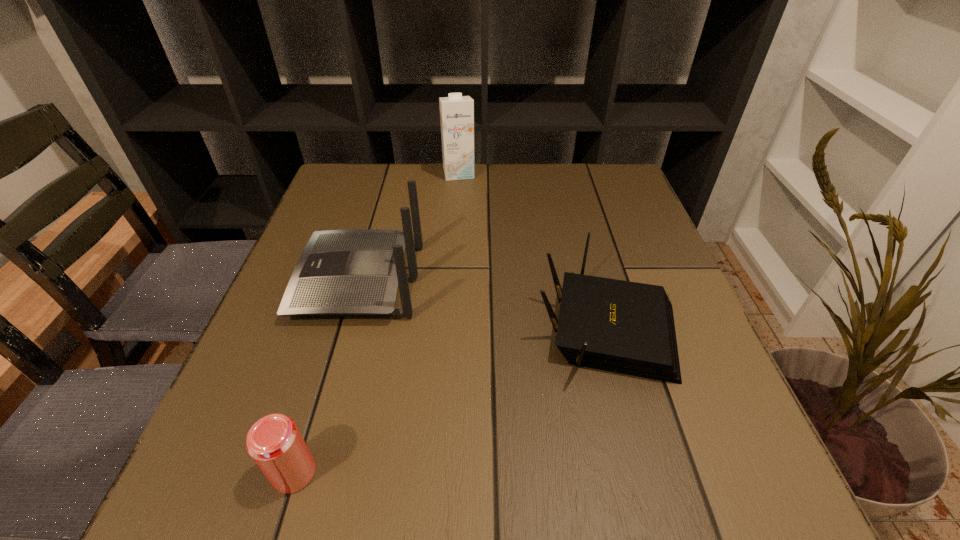
This screenshot has width=960, height=540. Find the location of `the tallest object`. the tallest object is located at coordinates (456, 111).

Find the location of a particular element. the farthest object is located at coordinates (456, 111).

Find the location of a particular element. This screenshot has width=960, height=540. the left router is located at coordinates (356, 272).

I want to click on the taller router, so click(356, 272).

This screenshot has height=540, width=960. I want to click on the right router, so click(x=625, y=327).

The height and width of the screenshot is (540, 960). I want to click on the rightmost object, so click(x=625, y=327).

The image size is (960, 540). Find the location of `beer can`. beer can is located at coordinates (274, 442).

At what (x,y) coordinates should I click in order to perform the action: click on vacant space located 0.070m on the left of the farthest object. Please return your answer as a coordinate pair (x, y). This screenshot has height=540, width=960. Looking at the image, I should click on (418, 173).

At what (x,y) coordinates should I click in order to perform the action: click on free region located on the back of the rightmost object. Please return your answer as a coordinate pair (x, y). The height and width of the screenshot is (540, 960). Looking at the image, I should click on 575,210.

Locate an element on the screen. free region located 0.180m on the right of the nearest object is located at coordinates (442, 472).